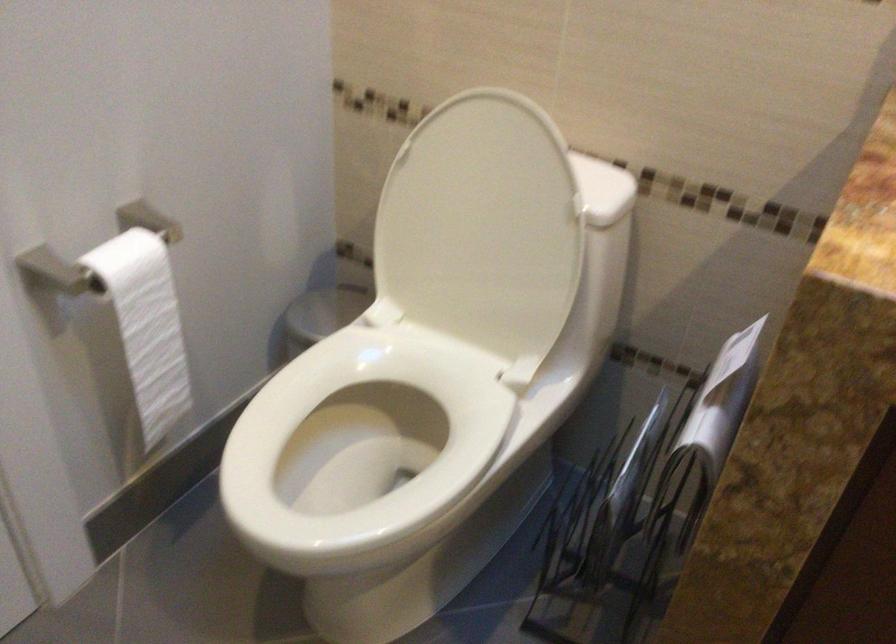
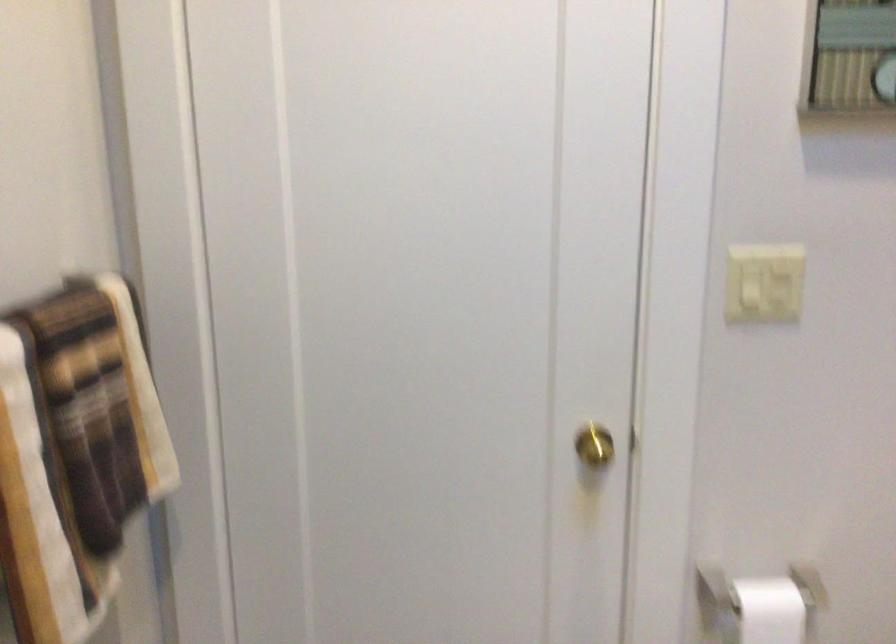
Question: The camera is either moving clockwise (left) or counter-clockwise (right) around the object. The first image is from the beginning of the video and the second image is from the end. Is the camera moving left or right when shooting the video?

Choices:
 (A) Left
 (B) Right

Answer: (B)